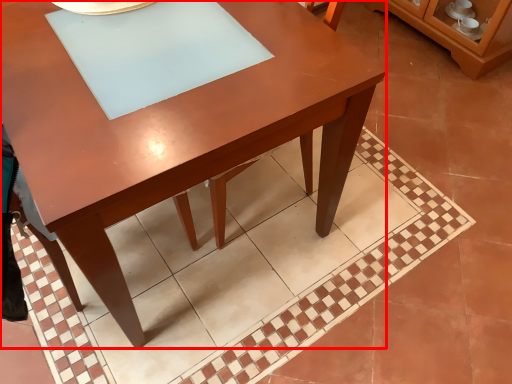
Question: From the image's perspective, what is the correct spatial positioning of table (annotated by the red box) in reference to dresser?

Choices:
 (A) above
 (B) below

Answer: (B)